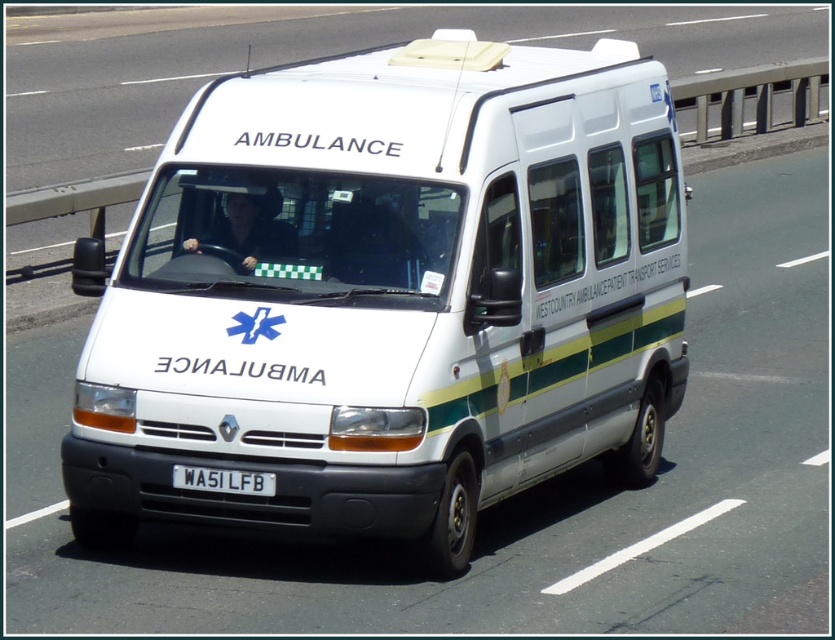
Question: Can you confirm if white matte ambulance at center is positioned to the left of white plastic license plate at center?

Choices:
 (A) no
 (B) yes

Answer: (A)

Question: Does white matte ambulance at center lie in front of white plastic license plate at center?

Choices:
 (A) yes
 (B) no

Answer: (A)

Question: Does white matte ambulance at center appear on the right side of white plastic license plate at center?

Choices:
 (A) yes
 (B) no

Answer: (A)

Question: Which point is farther to the camera?

Choices:
 (A) (233, 474)
 (B) (332, 67)

Answer: (B)

Question: Which of the following is the farthest from the observer?

Choices:
 (A) white matte ambulance at center
 (B) white plastic license plate at center

Answer: (B)